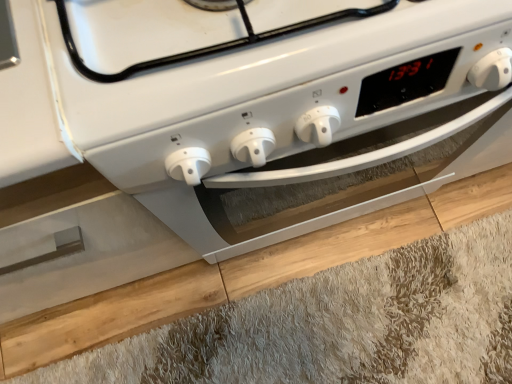
Question: Relative to white glossy oven at center, is light brown wood at lower center in front or behind?

Choices:
 (A) behind
 (B) front

Answer: (A)

Question: Would you say light brown wood at lower center is inside or outside white glossy oven at center?

Choices:
 (A) outside
 (B) inside

Answer: (A)

Question: Does point (34, 314) appear closer or farther from the camera than point (27, 21)?

Choices:
 (A) farther
 (B) closer

Answer: (A)

Question: In terms of height, does white glossy oven at center look taller or shorter compared to light brown wood at lower center?

Choices:
 (A) short
 (B) tall

Answer: (B)

Question: Looking at the image, does white glossy oven at center seem bigger or smaller compared to light brown wood at lower center?

Choices:
 (A) small
 (B) big

Answer: (A)

Question: Which is correct: white glossy oven at center is inside light brown wood at lower center, or outside of it?

Choices:
 (A) inside
 (B) outside

Answer: (B)

Question: In the image, is white glossy oven at center positioned in front of or behind light brown wood at lower center?

Choices:
 (A) behind
 (B) front

Answer: (B)